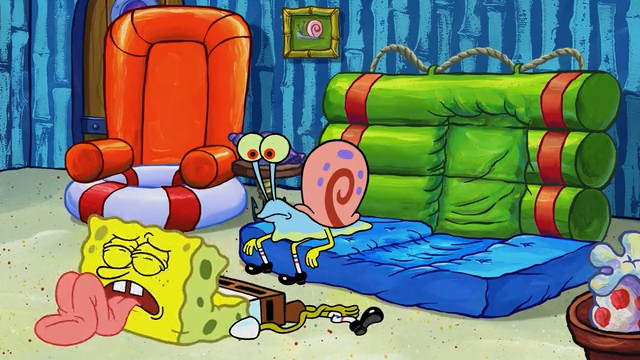
The height and width of the screenshot is (360, 640). What are the coordinates of `picture` in the screenshot? It's located at (307, 24).